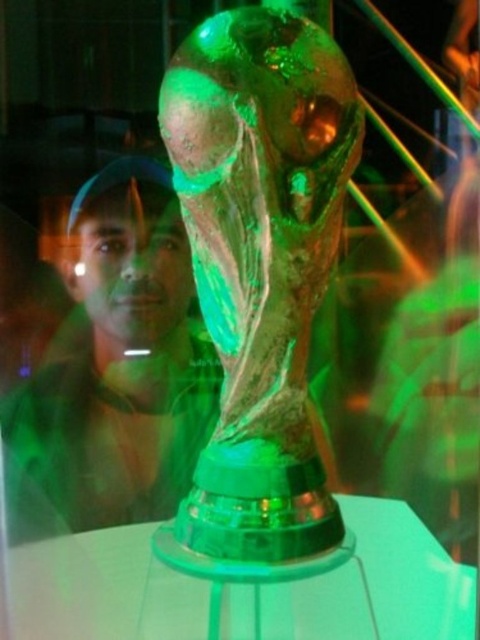
You are a photographer setting up a shot of the FIFA World Cup trophy. You notice the matte black cap at upper left and the transparent glass table at center. Which object should you focus on first if you want to capture the one closer to the camera?

The matte black cap at upper left is above the transparent glass table at center, so it is closer to the camera. Focus on the matte black cap at upper left first.

You are a photographer setting up for a photo shoot in the described scene. You need to place a small light source between the matte black cap at upper left and the transparent glass table at center. Based on their positions, which object should the light be placed closer to?

The matte black cap at upper left is positioned on the right side of transparent glass table at center, so the light should be placed closer to the transparent glass table at center since the cap is to its right.